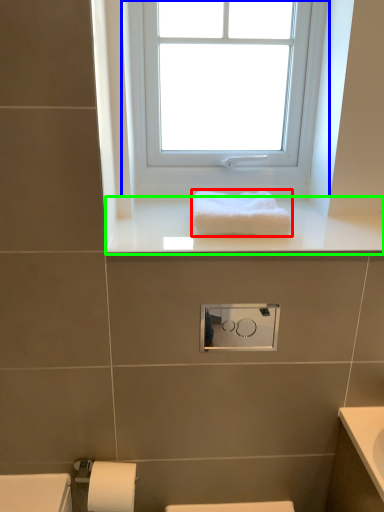
Question: Estimate the real-world distances between objects in this image. Which object is farther from towel (highlighted by a red box), window (highlighted by a blue box) or window sill (highlighted by a green box)?

Choices:
 (A) window
 (B) window sill

Answer: (A)